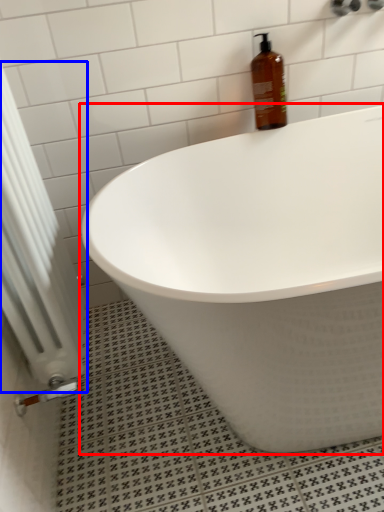
Question: Which point is further to the camera, bathtub (highlighted by a red box) or radiator (highlighted by a blue box)?

Choices:
 (A) bathtub
 (B) radiator

Answer: (A)